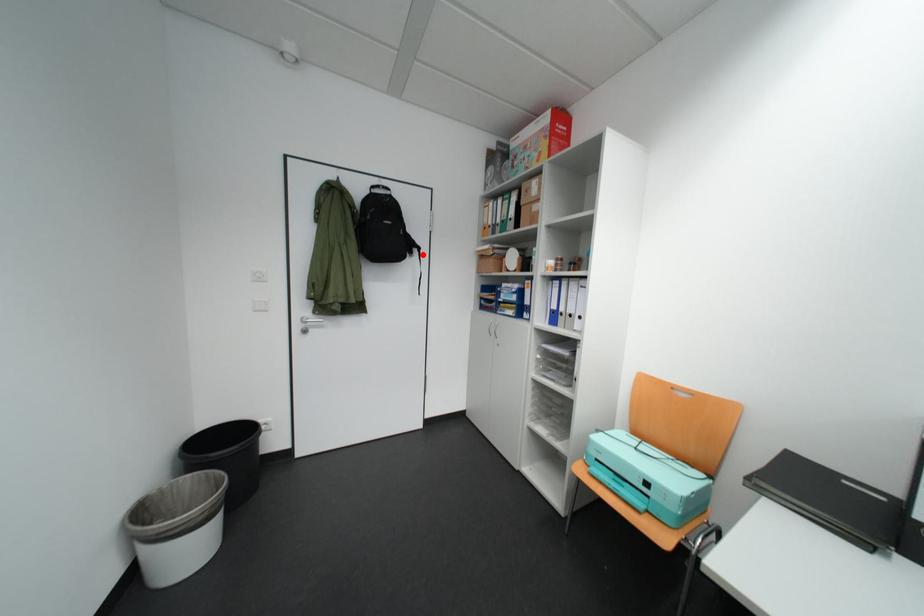
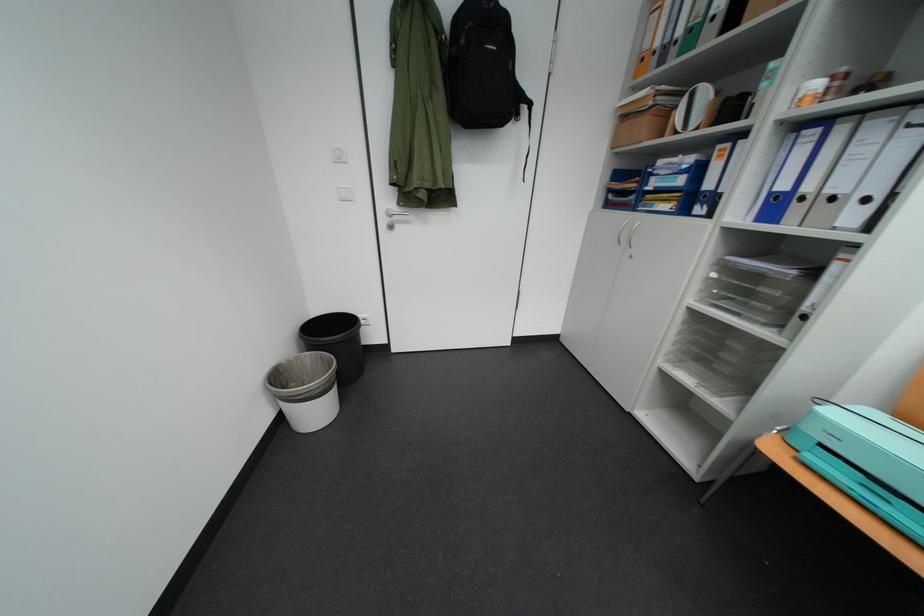
The point at the highlighted location is marked in the first image. Where is the corresponding point in the second image?

(529, 116)